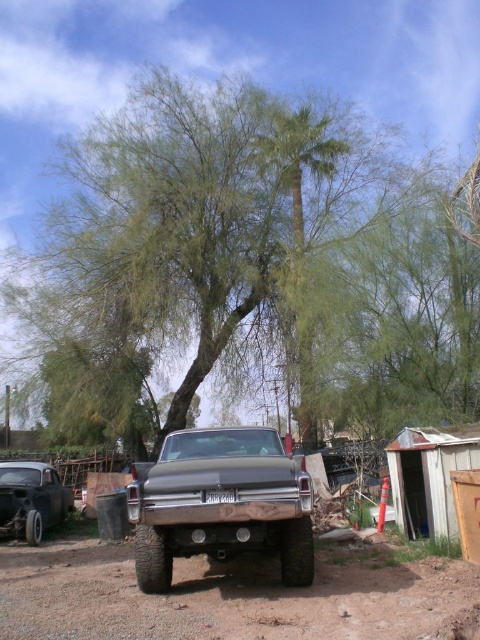
Question: Does dirt track at lower center appear over rusty metal car at lower left?

Choices:
 (A) yes
 (B) no

Answer: (A)

Question: Which point is farther from the camera taking this photo?

Choices:
 (A) (462, 458)
 (B) (37, 280)
 (C) (182, 493)

Answer: (B)

Question: Does green leafy tree at center have a larger size compared to matte black truck at center?

Choices:
 (A) no
 (B) yes

Answer: (B)

Question: Which of the following is the farthest from the observer?

Choices:
 (A) dirt track at lower center
 (B) rusty metal car at lower left

Answer: (B)

Question: Which point appears closest to the camera in this image?

Choices:
 (A) (420, 516)
 (B) (182, 560)
 (C) (52, 490)

Answer: (B)

Question: Does metal/wooden hut at lower right appear on the left side of rusty metal car at lower left?

Choices:
 (A) no
 (B) yes

Answer: (A)